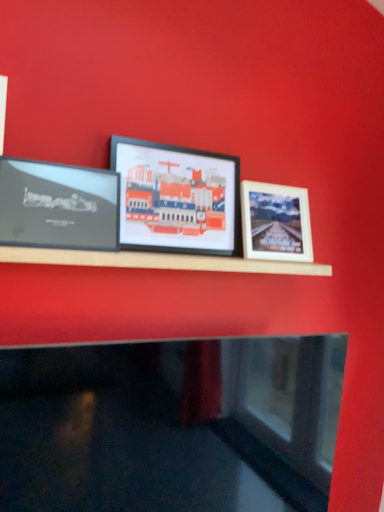
Question: Should I look upward or downward to see white matte picture frame at right, which ranks as the 1th picture frame in right-to-left order?

Choices:
 (A) up
 (B) down

Answer: (A)

Question: Would you say matte black picture frame at center, marked as the 2th picture frame in a left-to-right arrangement, is a long distance from white matte picture frame at right, which ranks as the 1th picture frame in right-to-left order?

Choices:
 (A) no
 (B) yes

Answer: (A)

Question: Is matte black picture frame at center, marked as the 2th picture frame in a left-to-right arrangement, behind white matte picture frame at right, the 3th picture frame viewed from the left?

Choices:
 (A) no
 (B) yes

Answer: (A)

Question: Is matte black picture frame at center, marked as the 2th picture frame in a left-to-right arrangement, at the left side of white matte picture frame at right, which ranks as the 1th picture frame in right-to-left order?

Choices:
 (A) no
 (B) yes

Answer: (B)

Question: Does matte black picture frame at center, the second picture frame in the right-to-left sequence, have a lesser height compared to white matte picture frame at right, the 3th picture frame viewed from the left?

Choices:
 (A) yes
 (B) no

Answer: (B)

Question: Is white matte picture frame at right, the 3th picture frame viewed from the left, a part of matte black picture frame at center, marked as the 2th picture frame in a left-to-right arrangement?

Choices:
 (A) yes
 (B) no

Answer: (B)

Question: From a real-world perspective, does matte black picture frame at center, marked as the 2th picture frame in a left-to-right arrangement, sit lower than white matte picture frame at right, the 3th picture frame viewed from the left?

Choices:
 (A) yes
 (B) no

Answer: (B)

Question: Does matte black picture frame at center, the second picture frame in the right-to-left sequence, have a greater width compared to matte black frame at left, the third picture frame in the right-to-left sequence?

Choices:
 (A) yes
 (B) no

Answer: (A)

Question: From a real-world perspective, is matte black picture frame at center, the second picture frame in the right-to-left sequence, physically above matte black frame at left, acting as the first picture frame starting from the left?

Choices:
 (A) yes
 (B) no

Answer: (A)

Question: Is matte black picture frame at center, the second picture frame in the right-to-left sequence, completely or partially outside of matte black frame at left, acting as the first picture frame starting from the left?

Choices:
 (A) yes
 (B) no

Answer: (A)

Question: Would you say matte black picture frame at center, marked as the 2th picture frame in a left-to-right arrangement, contains matte black frame at left, the third picture frame in the right-to-left sequence?

Choices:
 (A) yes
 (B) no

Answer: (B)

Question: From a real-world perspective, does matte black picture frame at center, the second picture frame in the right-to-left sequence, sit lower than matte black frame at left, acting as the first picture frame starting from the left?

Choices:
 (A) no
 (B) yes

Answer: (A)

Question: Is matte black picture frame at center, marked as the 2th picture frame in a left-to-right arrangement, oriented towards matte black frame at left, the third picture frame in the right-to-left sequence?

Choices:
 (A) no
 (B) yes

Answer: (A)

Question: From the image's perspective, does white matte picture frame at right, which ranks as the 1th picture frame in right-to-left order, appear lower than matte black picture frame at center, marked as the 2th picture frame in a left-to-right arrangement?

Choices:
 (A) yes
 (B) no

Answer: (A)